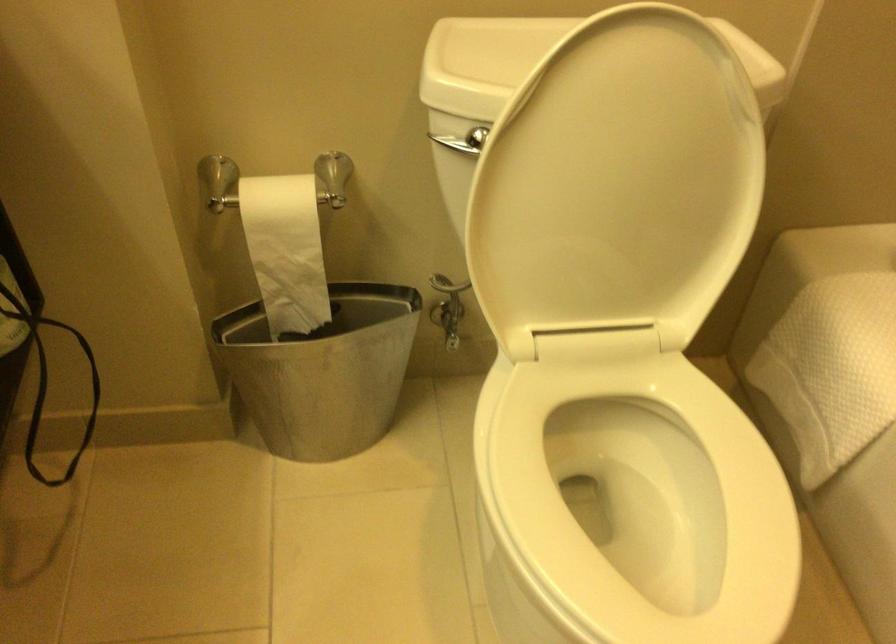
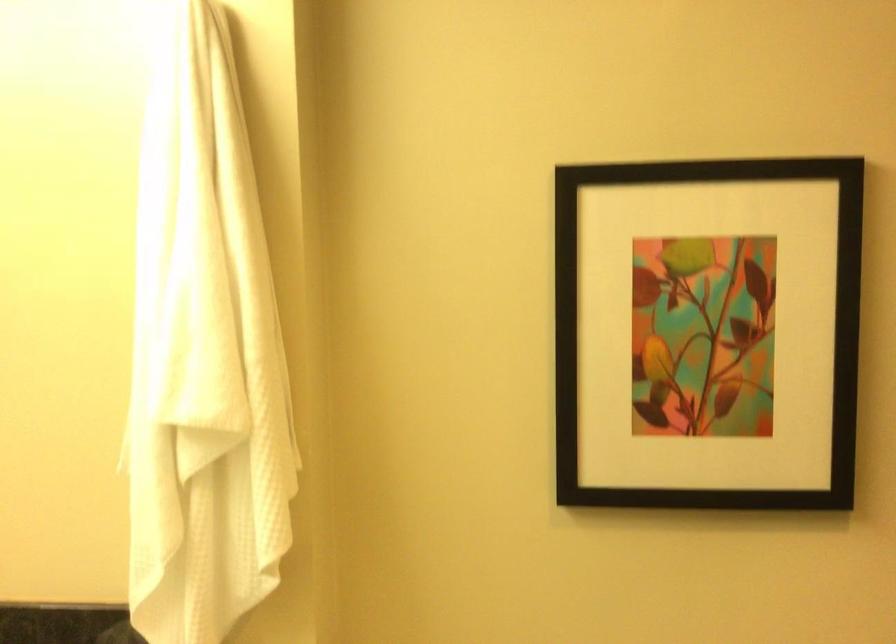
Consider the image. The first image is from the beginning of the video and the second image is from the end. How did the camera likely rotate when shooting the video?

The camera rotated toward left-up.